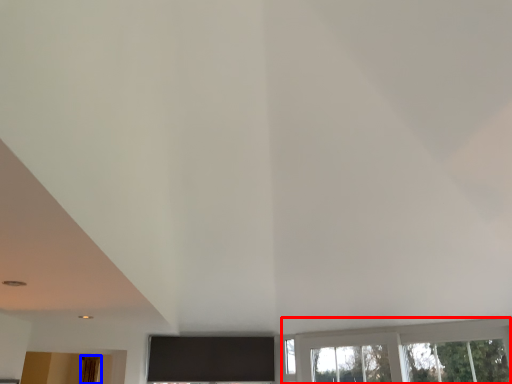
Question: Which point is closer to the camera, window (highlighted by a red box) or curtain (highlighted by a blue box)?

Choices:
 (A) window
 (B) curtain

Answer: (A)